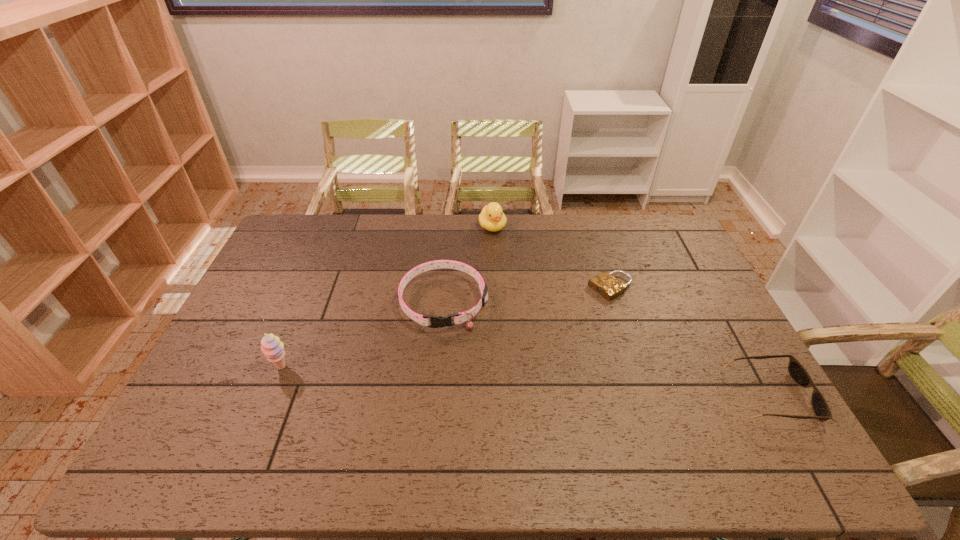
In order to click on vacant space situated 0.150m on the keyhole side of the padlock in this screenshot , I will do `click(560, 315)`.

Locate an element on the screen. vacant space located on the keyhole side of the padlock is located at coordinates (567, 311).

The width and height of the screenshot is (960, 540). Identify the location of free space located on the keyhole side of the padlock. (563, 314).

You are a GUI agent. You are given a task and a screenshot of the screen. Output one action in this format:
    pyautogui.click(x=<x>, y=<y>)
    Task: Click on the vacant space located 0.110m with the buckle on the third shortest object
    Image resolution: width=960 pixels, height=540 pixels.
    Given the screenshot: What is the action you would take?
    pyautogui.click(x=446, y=364)

Identify the location of vacant point located 0.120m with the buckle on the third shortest object. (446, 367).

Where is `vacant area situated 0.070m with the buckle on the third shortest object`? This screenshot has height=540, width=960. vacant area situated 0.070m with the buckle on the third shortest object is located at coordinates (446, 353).

Identify the location of vacant space located on the beak of the duckling. The height and width of the screenshot is (540, 960). (510, 264).

This screenshot has width=960, height=540. Identify the location of vacant position located 0.210m on the beak of the duckling. click(x=514, y=273).

Identify the location of free location located on the beak of the duckling. Image resolution: width=960 pixels, height=540 pixels. (514, 273).

This screenshot has height=540, width=960. Find the location of `object positioned at the far edge`. object positioned at the far edge is located at coordinates (492, 218).